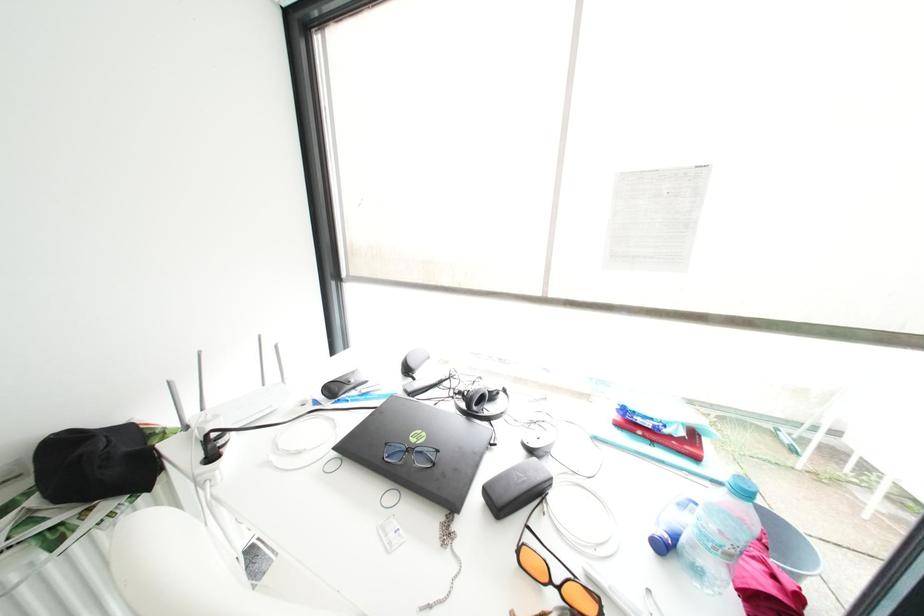
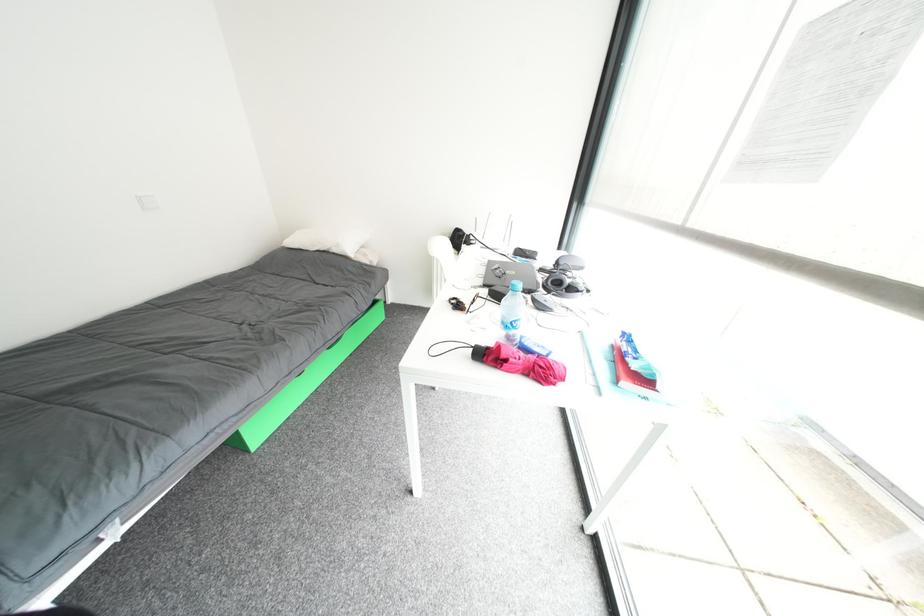
The first image is from the beginning of the video and the second image is from the end. How did the camera likely rotate when shooting the video?

The rotation direction of the camera is left-down.